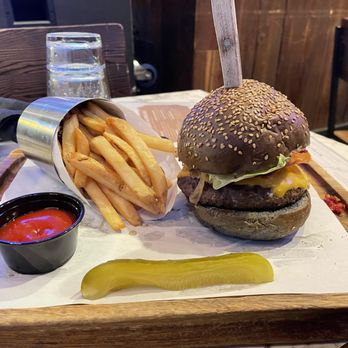
Locate an element on the screen. This screenshot has height=348, width=348. glass is located at coordinates (85, 62).